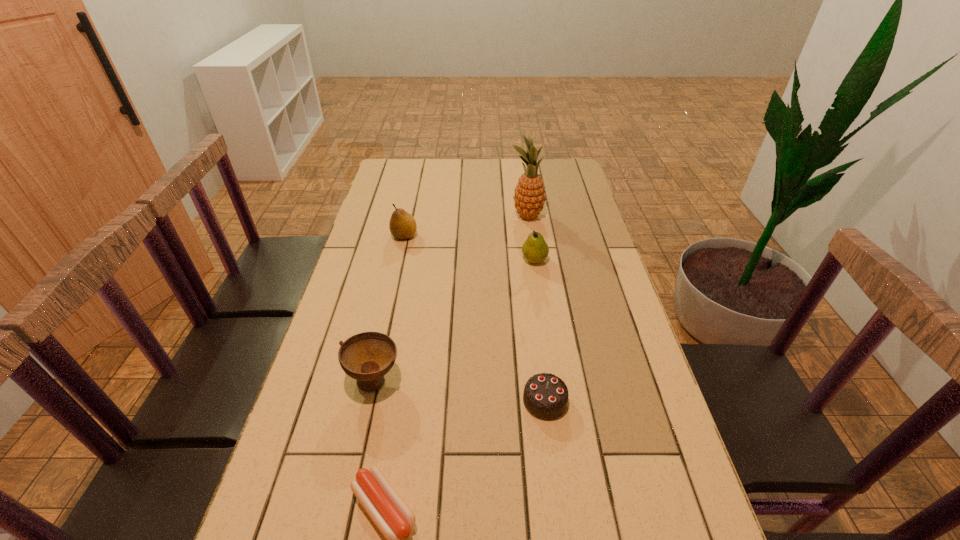
Find the location of a particular element. vacant space situated 0.300m on the back of the fourth nearest object is located at coordinates (526, 203).

This screenshot has width=960, height=540. What are the coordinates of `vacant space located 0.350m on the right of the soup bowl` in the screenshot? It's located at [547, 379].

You are a GUI agent. You are given a task and a screenshot of the screen. Output one action in this format:
    pyautogui.click(x=<x>, y=<y>)
    Task: Click on the free space located 0.110m on the front of the chocolate cake
    This screenshot has width=960, height=540.
    Given the screenshot: What is the action you would take?
    pyautogui.click(x=554, y=470)

At what (x,y) coordinates should I click in order to perform the action: click on pear located in the left edge section of the desktop. Please return your answer as a coordinate pair (x, y). Looking at the image, I should click on (402, 225).

Image resolution: width=960 pixels, height=540 pixels. I want to click on soup bowl at the left edge, so click(367, 357).

What are the coordinates of `blank space at the far edge` in the screenshot? It's located at (518, 160).

In order to click on vacant space at the left edge in this screenshot , I will do `click(325, 437)`.

This screenshot has height=540, width=960. In the image, there is a desktop. What are the coordinates of `blank space at the right edge` in the screenshot? It's located at (579, 285).

Identify the location of free space that is in between the right pear and the farther pear. pos(469,247).

At what (x,y) coordinates should I click in order to perform the action: click on free point between the right pear and the soup bowl. Please return your answer as a coordinate pair (x, y). The image size is (960, 540). Looking at the image, I should click on (454, 319).